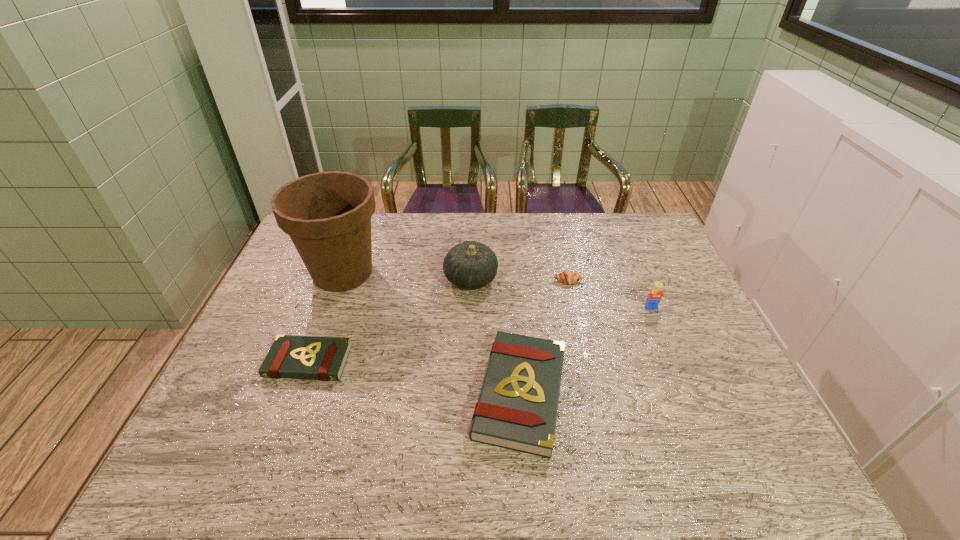
You are a GUI agent. You are given a task and a screenshot of the screen. Output one action in this format:
    pyautogui.click(x=<x>, y=<y>)
    Task: Click on the vacant position located on the back of the right book
    The width and height of the screenshot is (960, 540).
    Given the screenshot: What is the action you would take?
    pyautogui.click(x=513, y=301)

The width and height of the screenshot is (960, 540). I want to click on blank area located on the left of the second tallest object, so click(318, 279).

The image size is (960, 540). What are the coordinates of `vacant space located 0.090m on the face of the Lego` in the screenshot? It's located at (664, 338).

The height and width of the screenshot is (540, 960). Find the location of `vacant space located 0.290m on the right of the flowerpot`. vacant space located 0.290m on the right of the flowerpot is located at coordinates [x=476, y=273].

Find the location of a particular element. vacant region located on the front-facing side of the pastry is located at coordinates (588, 373).

Find the location of a particular element. Image resolution: width=960 pixels, height=540 pixels. object that is at the far edge is located at coordinates (327, 215).

Identify the location of object that is at the near edge. The image size is (960, 540). (517, 409).

This screenshot has width=960, height=540. I want to click on book located at the left edge, so click(x=294, y=357).

The image size is (960, 540). I want to click on flowerpot at the left edge, so click(327, 215).

The width and height of the screenshot is (960, 540). In order to click on object at the right edge in this screenshot , I will do `click(656, 294)`.